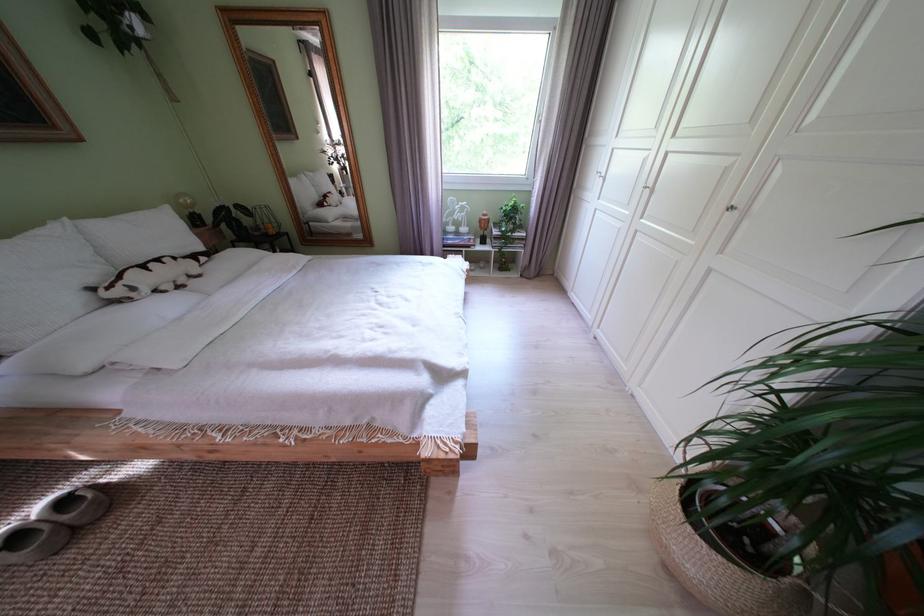
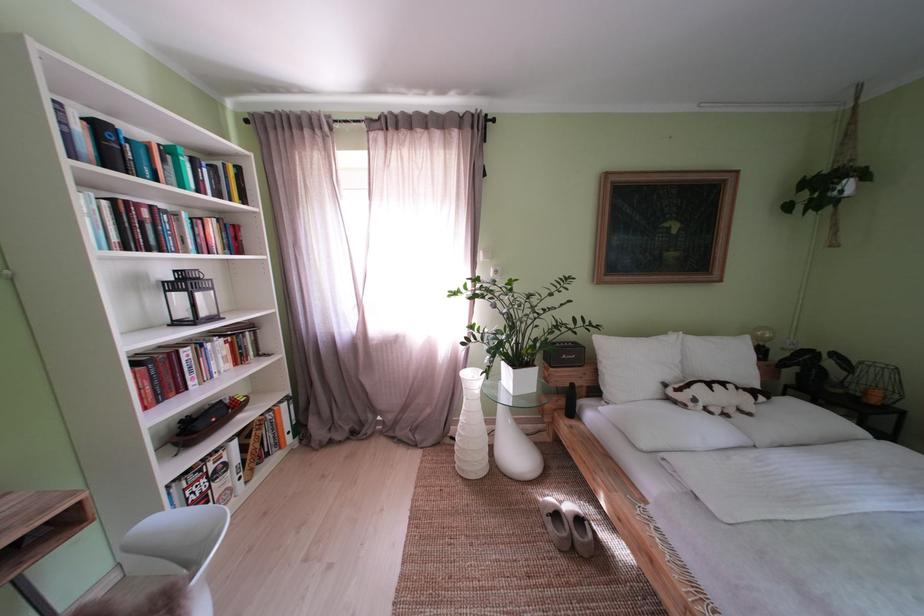
Where in the second image is the point corresponding to point 146,294 from the first image?

(706, 406)